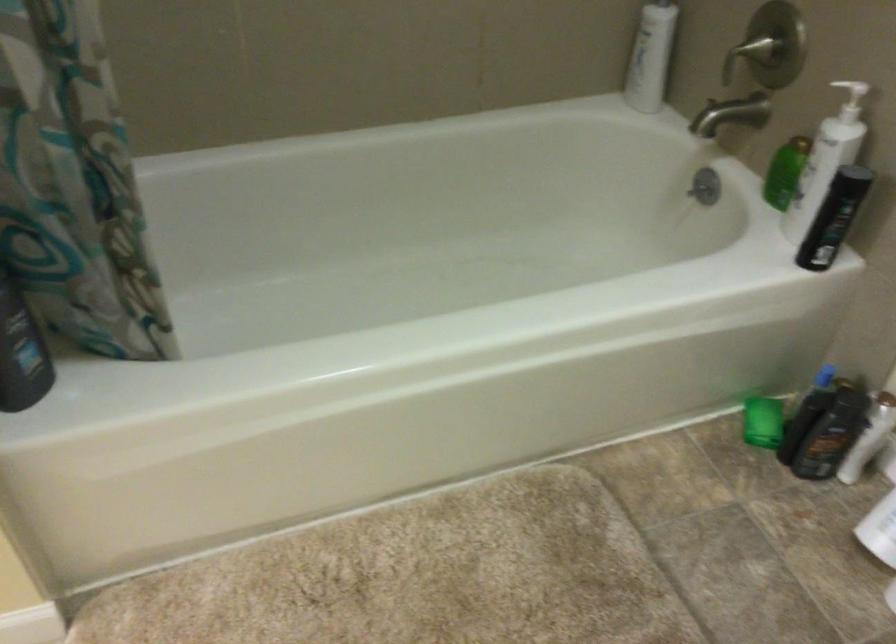
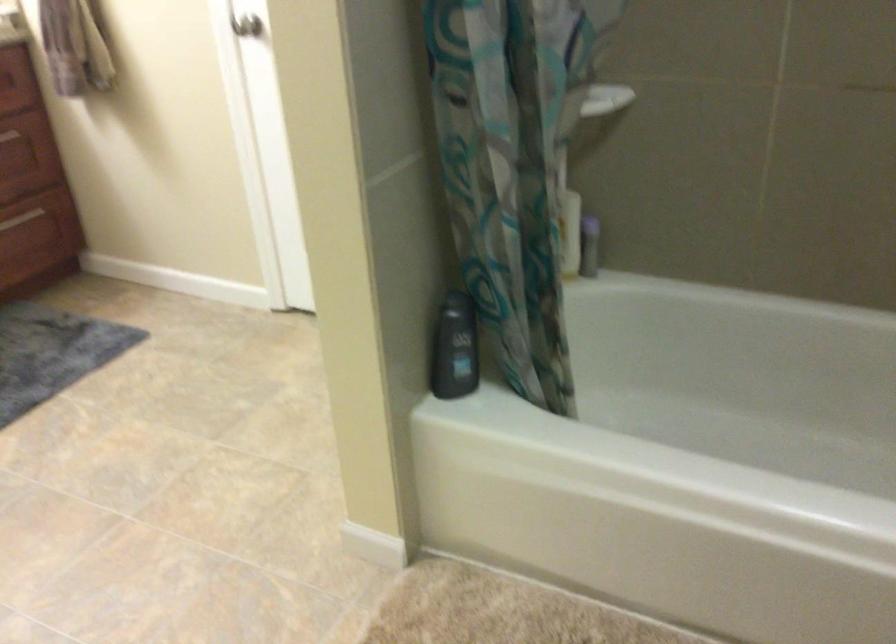
Question: The first image is from the beginning of the video and the second image is from the end. How did the camera likely rotate when shooting the video?

Choices:
 (A) Left
 (B) Right
 (C) Up
 (D) Down

Answer: (A)